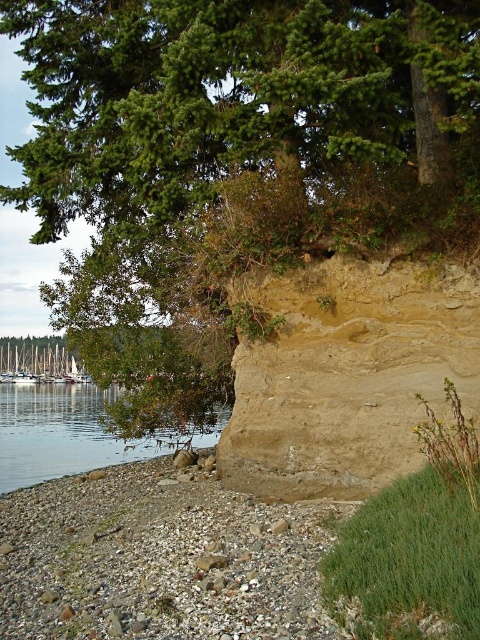
Is brown sandy cliff at center to the left of white wooden boats at lower left from the viewer's perspective?

Incorrect, brown sandy cliff at center is not on the left side of white wooden boats at lower left.

You are a GUI agent. You are given a task and a screenshot of the screen. Output one action in this format:
    pyautogui.click(x=<x>, y=<y>)
    Task: Click on the brown sandy cliff at center
    
    Given the screenshot: What is the action you would take?
    pyautogui.click(x=348, y=372)

Between brown sandy cliff at center and greenish water at lower left, which one has less height?

Standing shorter between the two is greenish water at lower left.

Between brown sandy cliff at center and greenish water at lower left, which one appears on the right side from the viewer's perspective?

brown sandy cliff at center is more to the right.

This screenshot has width=480, height=640. In order to click on brown sandy cliff at center in this screenshot , I will do `click(348, 372)`.

Locate an element on the screen. This screenshot has height=640, width=480. brown sandy cliff at center is located at coordinates [x=348, y=372].

Is green leafy tree at upper left above white wooden boats at lower left?

Indeed, green leafy tree at upper left is positioned over white wooden boats at lower left.

Based on the photo, who is positioned more to the left, green leafy tree at upper left or white wooden boats at lower left?

white wooden boats at lower left

Does point (238, 90) come in front of point (44, 337)?

Yes, point (238, 90) is in front of point (44, 337).

This screenshot has width=480, height=640. In order to click on green leafy tree at upper left in this screenshot , I will do `click(232, 164)`.